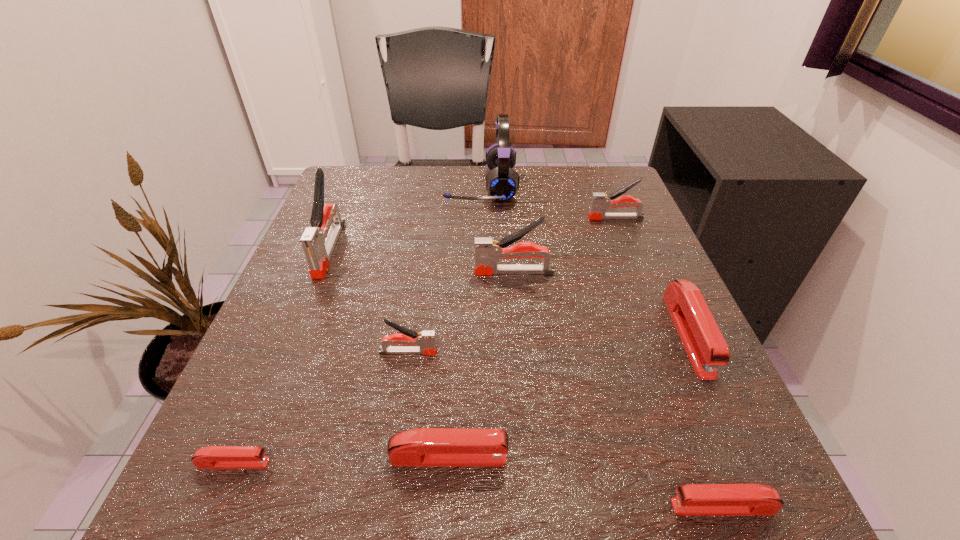
Locate an element on the screen. The width and height of the screenshot is (960, 540). vacant space located on the front-facing side of the second smallest red stapler is located at coordinates (496, 507).

Identify the location of free location located on the front-facing side of the second smallest red stapler. This screenshot has width=960, height=540. (455, 507).

At what (x,y) coordinates should I click in order to perform the action: click on free space located 0.210m on the front-facing side of the shortest stapler. Please return your answer as a coordinate pair (x, y). Image resolution: width=960 pixels, height=540 pixels. Looking at the image, I should click on (432, 463).

In order to click on headset that is at the far edge in this screenshot , I will do `click(502, 182)`.

This screenshot has height=540, width=960. What are the coordinates of `stapler that is at the far edge` in the screenshot? It's located at [600, 202].

Identify the location of object that is at the near left corner. This screenshot has height=540, width=960. (211, 457).

Locate an element on the screen. object situated at the far right corner is located at coordinates (600, 202).

Where is `object that is at the near right corner`? object that is at the near right corner is located at coordinates (693, 499).

Where is `free spot at the far edge of the desktop`? This screenshot has width=960, height=540. free spot at the far edge of the desktop is located at coordinates (469, 175).

In the image, there is a desktop. Where is `blank space at the near edge`? The width and height of the screenshot is (960, 540). blank space at the near edge is located at coordinates (536, 477).